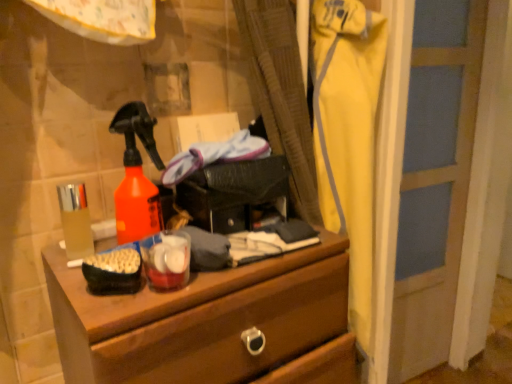
Question: Is wooden chest of drawers at center smaller than translucent plastic cup at left?

Choices:
 (A) yes
 (B) no

Answer: (B)

Question: From a real-world perspective, is wooden chest of drawers at center physically below translucent plastic cup at left?

Choices:
 (A) yes
 (B) no

Answer: (A)

Question: Is wooden chest of drawers at center positioned in front of translucent plastic cup at left?

Choices:
 (A) yes
 (B) no

Answer: (A)

Question: From the image's perspective, is wooden chest of drawers at center on top of translucent plastic cup at left?

Choices:
 (A) no
 (B) yes

Answer: (A)

Question: Is wooden chest of drawers at center shorter than translucent plastic cup at left?

Choices:
 (A) yes
 (B) no

Answer: (B)

Question: Is wooden chest of drawers at center further to camera compared to translucent plastic cup at left?

Choices:
 (A) no
 (B) yes

Answer: (A)

Question: Does translucent plastic cup at left appear on the left side of wooden chest of drawers at center?

Choices:
 (A) no
 (B) yes

Answer: (B)

Question: Does translucent plastic cup at left have a greater width compared to wooden chest of drawers at center?

Choices:
 (A) no
 (B) yes

Answer: (A)

Question: From the image's perspective, is translucent plastic cup at left under wooden chest of drawers at center?

Choices:
 (A) no
 (B) yes

Answer: (A)

Question: Would you say translucent plastic cup at left contains wooden chest of drawers at center?

Choices:
 (A) yes
 (B) no

Answer: (B)

Question: Is translucent plastic cup at left at the right side of wooden chest of drawers at center?

Choices:
 (A) no
 (B) yes

Answer: (A)

Question: Is translucent plastic cup at left oriented away from wooden chest of drawers at center?

Choices:
 (A) no
 (B) yes

Answer: (A)

Question: Is translucent plastic cup at left smaller than yellow fabric pants at right?

Choices:
 (A) no
 (B) yes

Answer: (B)